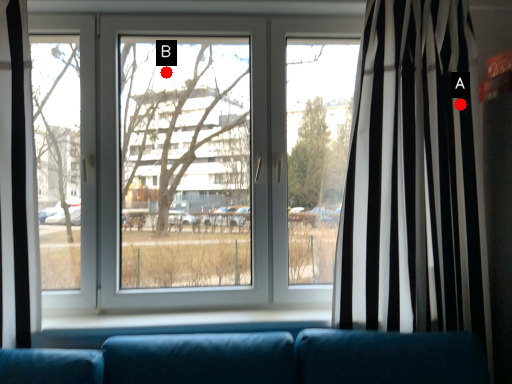
Question: Two points are circled on the image, labeled by A and B beside each circle. Among these points, which one is nearest to the camera?

Choices:
 (A) A is closer
 (B) B is closer

Answer: (A)